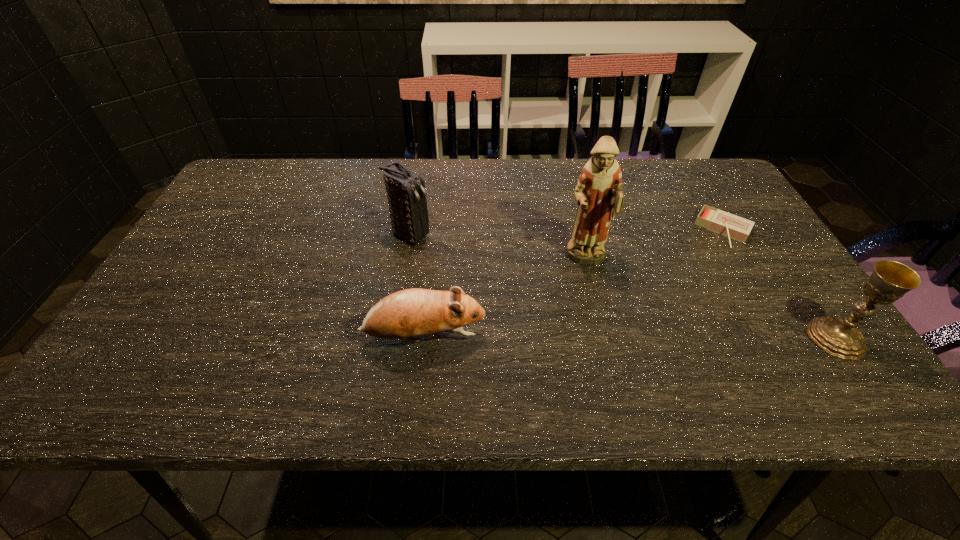
Where is `free region located with the zip open on the clutch bag`? The width and height of the screenshot is (960, 540). free region located with the zip open on the clutch bag is located at coordinates (537, 302).

The image size is (960, 540). I want to click on blank space located 0.230m on the front-facing side of the third object from left to right, so [608, 354].

Find the location of a particular element. Image resolution: width=960 pixels, height=540 pixels. free region located 0.250m on the front-facing side of the third object from left to right is located at coordinates (610, 363).

Locate an element on the screen. The image size is (960, 540). free spot located on the front-facing side of the third object from left to right is located at coordinates (603, 331).

Where is `vacant space located 0.290m on the striking surface of the shortest object`? This screenshot has width=960, height=540. vacant space located 0.290m on the striking surface of the shortest object is located at coordinates (678, 314).

Identify the location of free spot located 0.310m on the striking surface of the shortest object. (675, 319).

The width and height of the screenshot is (960, 540). I want to click on free space located on the striking surface of the shortest object, so click(x=707, y=262).

Where is `hamster located at the near edge`? hamster located at the near edge is located at coordinates (415, 312).

Where is `chalice located in the near edge section of the desktop`? This screenshot has width=960, height=540. chalice located in the near edge section of the desktop is located at coordinates (890, 280).

Locate an element on the screen. Image resolution: width=960 pixels, height=540 pixels. chalice that is at the right edge is located at coordinates (890, 280).